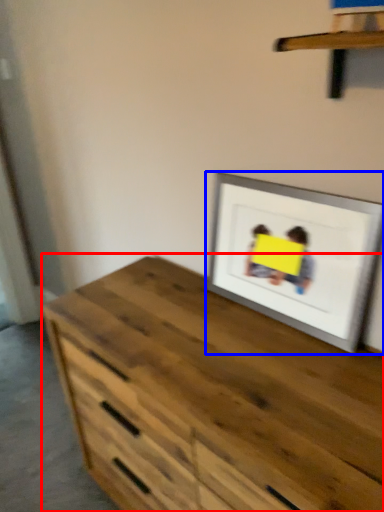
Question: Which object is further to the camera taking this photo, chest of drawers (highlighted by a red box) or picture frame (highlighted by a blue box)?

Choices:
 (A) chest of drawers
 (B) picture frame

Answer: (B)